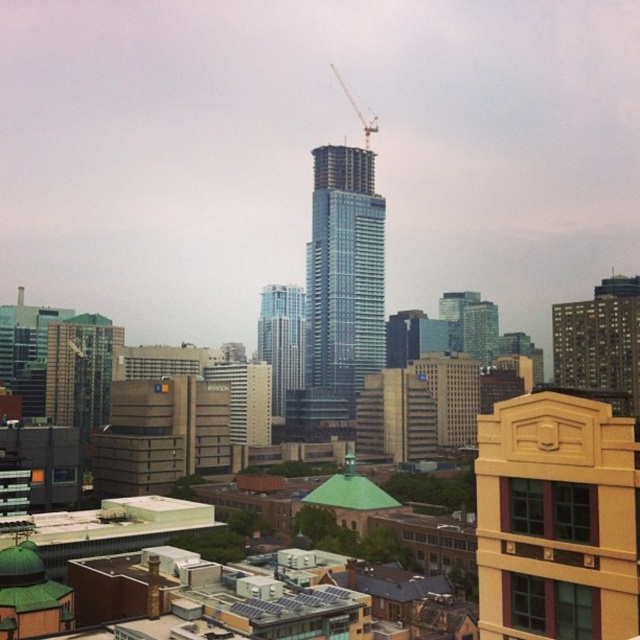
Question: From the image, what is the correct spatial relationship of transparent glass skyscraper at center in relation to dark gray concrete building at right?

Choices:
 (A) above
 (B) below

Answer: (A)

Question: Does glassy blue skyscraper at center appear over metallic construction crane at upper center?

Choices:
 (A) yes
 (B) no

Answer: (B)

Question: Estimate the real-world distances between objects in this image. Which object is closer to the transparent glass skyscraper at center?

Choices:
 (A) metallic construction crane at upper center
 (B) matte glass building at left

Answer: (A)

Question: Which point is closer to the camera?

Choices:
 (A) metallic construction crane at upper center
 (B) glassy blue skyscraper at center
 (C) transparent glass skyscraper at center

Answer: (C)

Question: Can you confirm if matte glass building at left is positioned below metallic construction crane at upper center?

Choices:
 (A) yes
 (B) no

Answer: (A)

Question: Which point is farther from the camera taking this photo?

Choices:
 (A) (589, 353)
 (B) (76, 358)
 (C) (515, 509)
 (D) (342, 160)

Answer: (D)